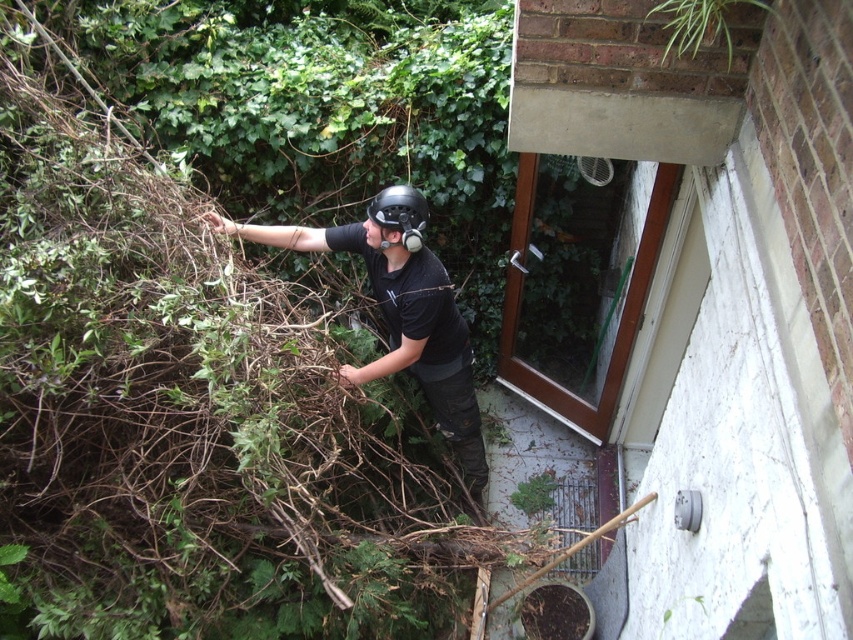
You are an inspector checking safety gear in the image. You notice two helmets labeled as black matte helmet at upper left and matte black helmet at center. According to safety regulations, the helmet must be the same size. Is there a compliance issue here?

Yes, there is a compliance issue because the black matte helmet at upper left is bigger than the matte black helmet at center, violating the requirement for all helmets to be the same size.

You are a safety inspector at the construction site. You need to check if the distance between the black matte helmet at upper left and the camera is within the 3 meters safety regulation. Can you confirm?

The black matte helmet at upper left and camera are 2.93 meters apart from each other, which is within the 3 meters safety regulation.